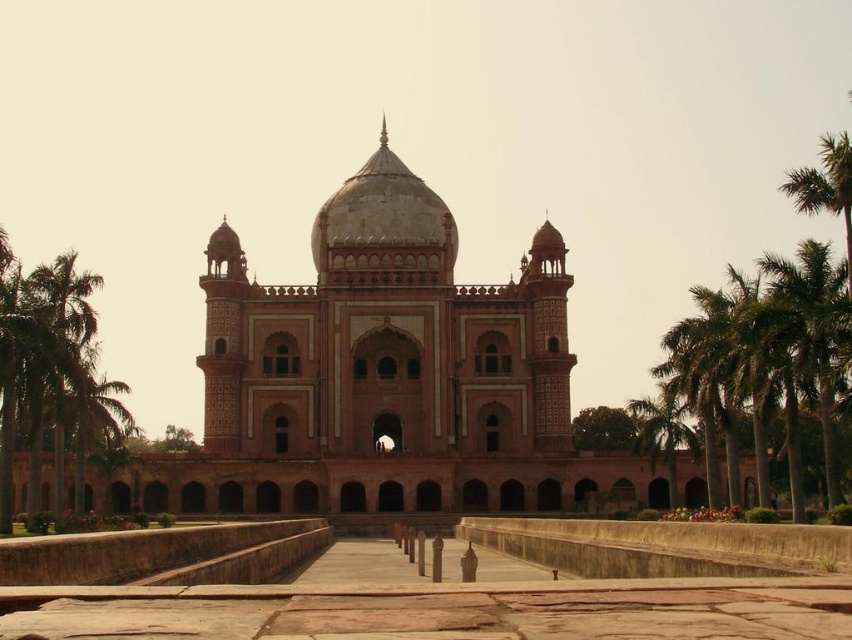
You are standing in front of the pink stone palace at center and the green leafy palm tree at left. Which one is more to the left?

The green leafy palm tree at left is more to the left.

You are a drone operator tasked with capturing aerial footage of the grand monument. Your drone has a maximum flight range of 60 meters from its starting position. If you position the drone at the base of the green leafy palm tree at left, will it be able to fly to the green leafy palm tree at right without exceeding its range?

The distance between the green leafy palm tree at left and the green leafy palm tree at right is 63.44 meters. Since the drone has a maximum flight range of 60 meters, it cannot reach the green leafy palm tree at right from the green leafy palm tree at left without exceeding its range.